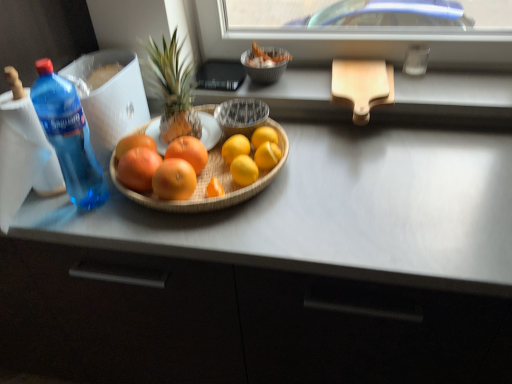
Question: From a real-world perspective, is orange matte grapefruit at center, arranged as the 3th grapefruit when viewed from the left, located higher than bamboo tray at center?

Choices:
 (A) no
 (B) yes

Answer: (B)

Question: Is orange matte grapefruit at center, positioned as the 3th grapefruit in right-to-left order, positioned beyond the bounds of bamboo tray at center?

Choices:
 (A) yes
 (B) no

Answer: (B)

Question: Is orange matte grapefruit at center, positioned as the 3th grapefruit in right-to-left order, shorter than bamboo tray at center?

Choices:
 (A) yes
 (B) no

Answer: (B)

Question: Is orange matte grapefruit at center, positioned as the 3th grapefruit in right-to-left order, bigger than bamboo tray at center?

Choices:
 (A) yes
 (B) no

Answer: (B)

Question: Is orange matte grapefruit at center, positioned as the 3th grapefruit in right-to-left order, next to bamboo tray at center and touching it?

Choices:
 (A) yes
 (B) no

Answer: (A)

Question: Does orange matte grapefruit at center, positioned as the 3th grapefruit in right-to-left order, appear on the left side of bamboo tray at center?

Choices:
 (A) no
 (B) yes

Answer: (B)

Question: Is blue translucent bottle at left shorter than orange matte grapefruit at center, which ranks as the fourth grapefruit in right-to-left order?

Choices:
 (A) no
 (B) yes

Answer: (A)

Question: Is orange matte grapefruit at center, marked as the 2th grapefruit in a left-to-right arrangement, at the back of blue translucent bottle at left?

Choices:
 (A) yes
 (B) no

Answer: (B)

Question: From the image's perspective, is blue translucent bottle at left on orange matte grapefruit at center, which ranks as the fourth grapefruit in right-to-left order?

Choices:
 (A) yes
 (B) no

Answer: (A)

Question: Does blue translucent bottle at left turn towards orange matte grapefruit at center, which ranks as the fourth grapefruit in right-to-left order?

Choices:
 (A) no
 (B) yes

Answer: (A)

Question: From a real-world perspective, is blue translucent bottle at left under orange matte grapefruit at center, marked as the 2th grapefruit in a left-to-right arrangement?

Choices:
 (A) no
 (B) yes

Answer: (A)

Question: Considering the relative sizes of blue translucent bottle at left and orange matte grapefruit at center, marked as the 2th grapefruit in a left-to-right arrangement, in the image provided, is blue translucent bottle at left taller than orange matte grapefruit at center, marked as the 2th grapefruit in a left-to-right arrangement,?

Choices:
 (A) no
 (B) yes

Answer: (B)

Question: Does bamboo tray at center have a lesser width compared to metallic silver bowl at upper center?

Choices:
 (A) no
 (B) yes

Answer: (A)